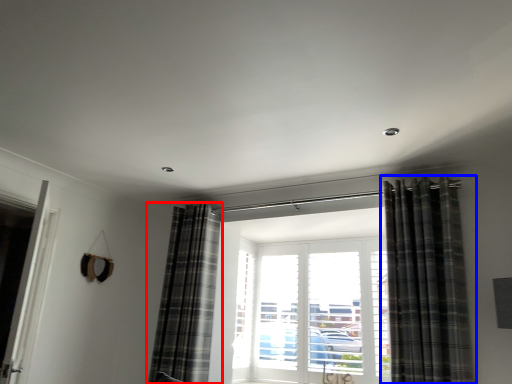
Question: Which object is closer to the camera taking this photo, curtain (highlighted by a red box) or curtain (highlighted by a blue box)?

Choices:
 (A) curtain
 (B) curtain

Answer: (B)